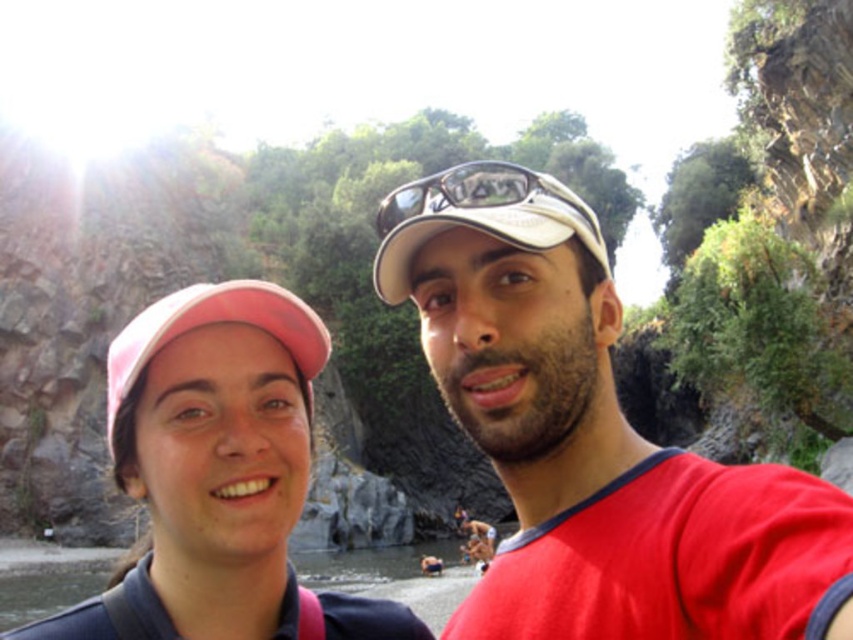
Question: Does matte red shirt at center have a smaller size compared to pink fabric cap at upper left?

Choices:
 (A) no
 (B) yes

Answer: (B)

Question: Which object is farther from the camera taking this photo?

Choices:
 (A) matte red shirt at center
 (B) pink fabric cap at upper left

Answer: (B)

Question: Is matte red shirt at center above matte black goggles at center?

Choices:
 (A) yes
 (B) no

Answer: (B)

Question: Which point appears closest to the camera in this image?

Choices:
 (A) (495, 189)
 (B) (296, 472)

Answer: (A)

Question: Which point is farther to the camera?

Choices:
 (A) matte red shirt at center
 (B) pink fabric cap at upper left

Answer: (B)

Question: Can you confirm if pink fabric cap at upper left is positioned to the left of matte black goggles at center?

Choices:
 (A) yes
 (B) no

Answer: (A)